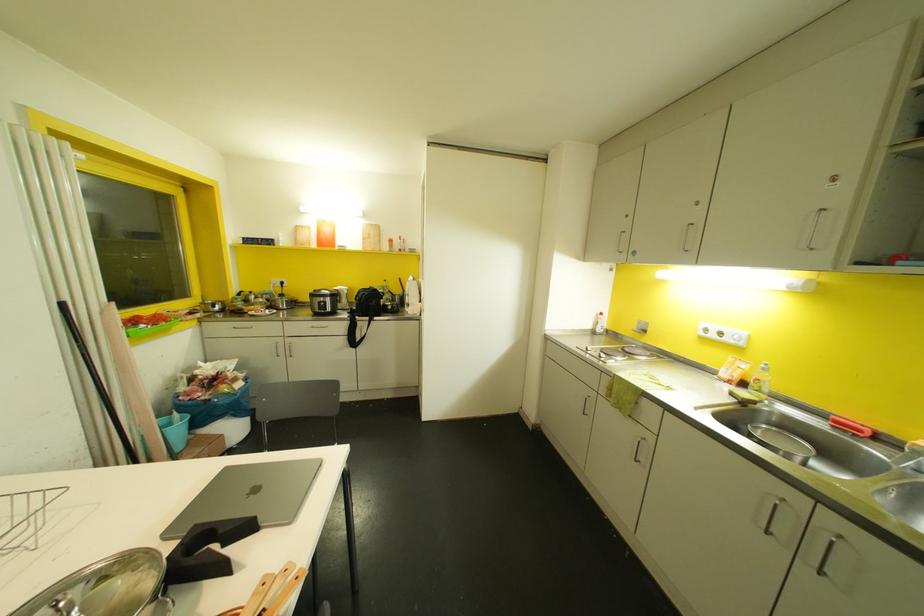
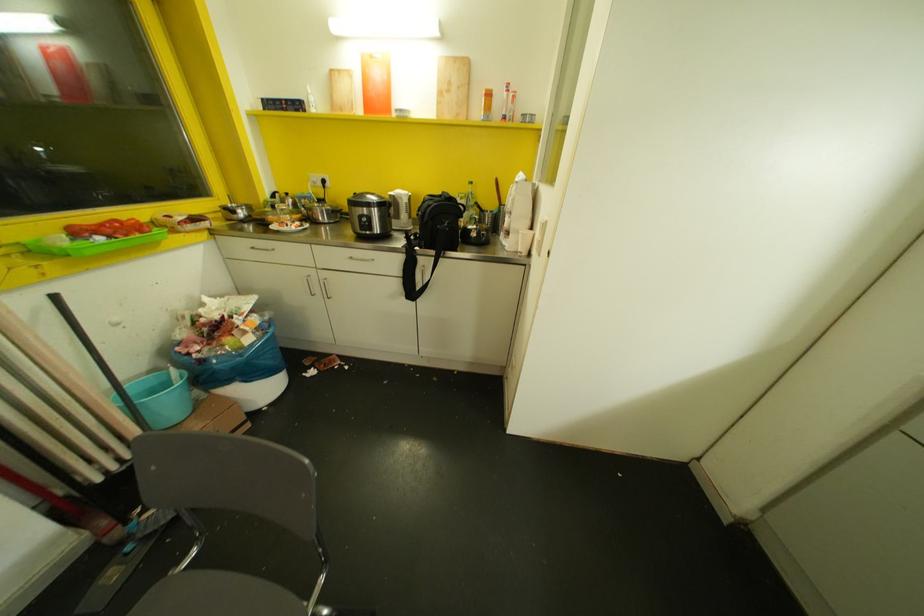
Locate, in the second image, the point that corresponds to (141,325) in the first image.

(99, 237)